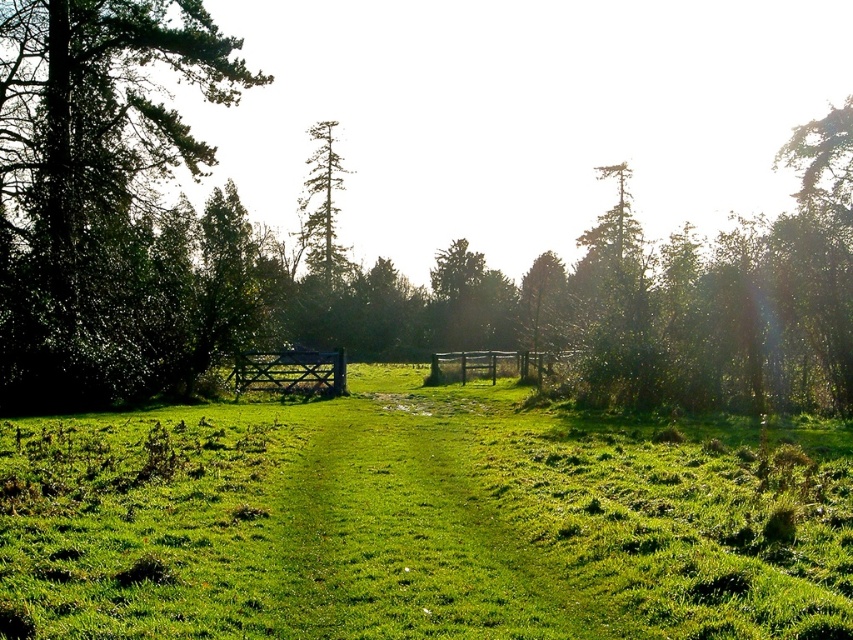
Question: Is green leafy tree at left wider than wooden fence at center?

Choices:
 (A) yes
 (B) no

Answer: (A)

Question: Is green grassy pasture at center further to camera compared to wooden fence at center?

Choices:
 (A) yes
 (B) no

Answer: (B)

Question: Estimate the real-world distances between objects in this image. Which object is farther from the green leafy tree at left?

Choices:
 (A) wooden gate at center
 (B) wooden fence at center

Answer: (B)

Question: Which object is positioned closest to the green leafy tree at left?

Choices:
 (A) green grassy pasture at center
 (B) wooden gate at center
 (C) wooden fence at center

Answer: (B)

Question: Can you confirm if green grassy pasture at center is positioned to the right of wooden gate at center?

Choices:
 (A) yes
 (B) no

Answer: (A)

Question: Which point is closer to the camera taking this photo?

Choices:
 (A) (248, 372)
 (B) (509, 432)
 (C) (90, 61)
 (D) (485, 376)

Answer: (B)